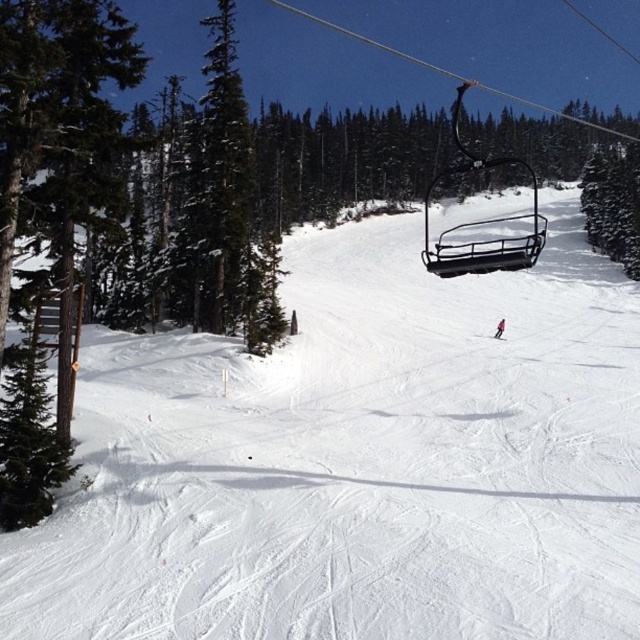
You are a photographer at the ski resort and want to capture a photo of the pink fabric skier at center and the pink matte ski at center. Which object will appear larger in the photo?

The pink fabric skier at center will appear larger in the photo because it is closer to the viewer than the pink matte ski at center.

You are navigating a drone over the winter scene at a ski resort. The drone must avoid obstacles and reach the white snow ski slope at center. According to the coordinates provided, is the slope centrally located in the image?

The white snow ski slope at center is located at coordinates point (358,461), which means it is not exactly at the center of the image since the coordinates would need to be around (320,320) for true center. Therefore, the slope is positioned more towards the lower right quadrant of the image.